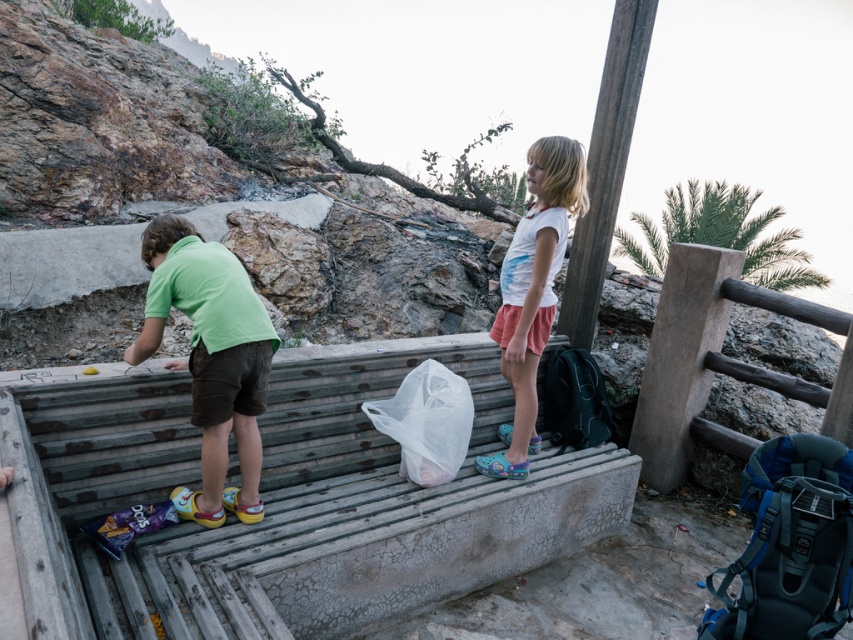
Question: Observing the image, what is the correct spatial positioning of transparent plastic bag at center in reference to black fabric backpack at lower right?

Choices:
 (A) above
 (B) below

Answer: (B)

Question: Which point is closer to the camera?

Choices:
 (A) black fabric backpack at lower right
 (B) green matte shirt at left
 (C) transparent plastic bag at center
 (D) rusty metal bench at center

Answer: (D)

Question: Which of these objects is positioned closest to the rusty metal bench at center?

Choices:
 (A) blue fabric backpack at lower right
 (B) green matte shirt at left

Answer: (B)

Question: Can you confirm if green matte shirt at left is bigger than transparent plastic bag at center?

Choices:
 (A) yes
 (B) no

Answer: (A)

Question: Estimate the real-world distances between objects in this image. Which object is farther from the black fabric backpack at lower right?

Choices:
 (A) blue fabric backpack at lower right
 (B) green matte shirt at left
 (C) rusty metal bench at center
 (D) transparent plastic bag at center

Answer: (B)

Question: Does blue fabric backpack at lower right have a larger size compared to white cotton shirt at center?

Choices:
 (A) no
 (B) yes

Answer: (A)